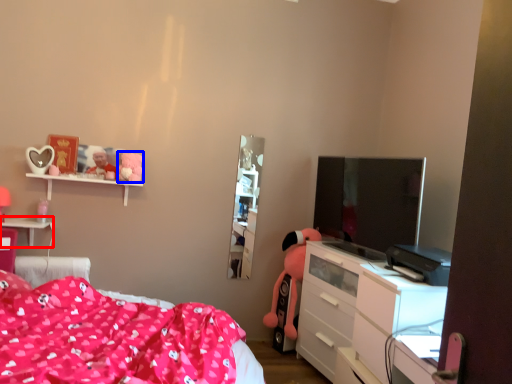
Question: Which object is further to the camera taking this photo, table (highlighted by a red box) or toy (highlighted by a blue box)?

Choices:
 (A) table
 (B) toy

Answer: (B)